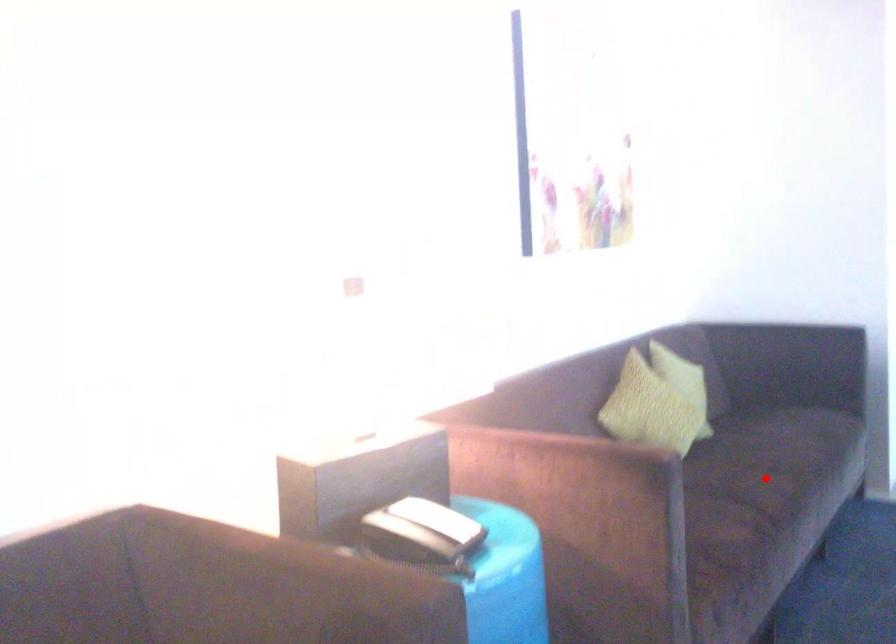
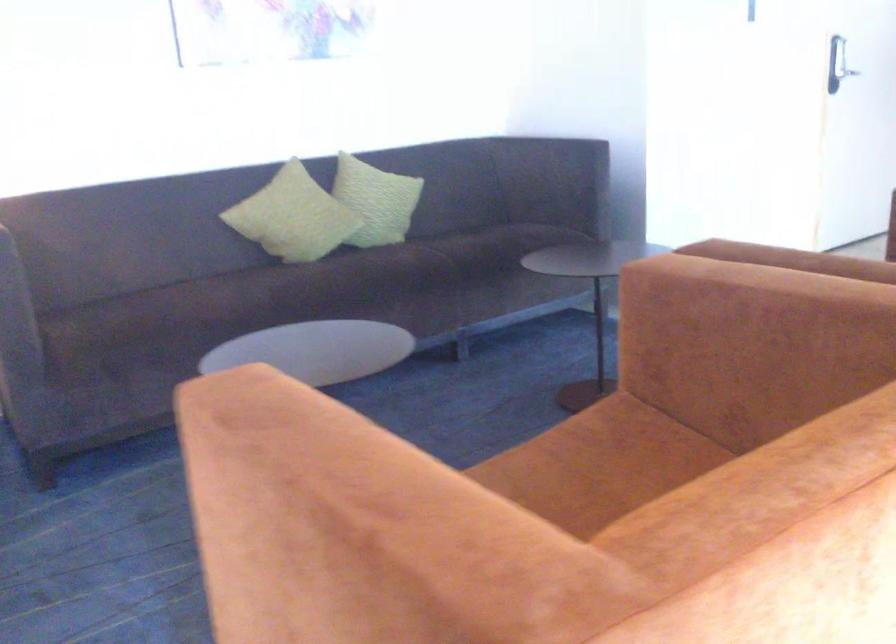
In the second image, find the point that corresponds to the highlighted location in the first image.

(270, 290)